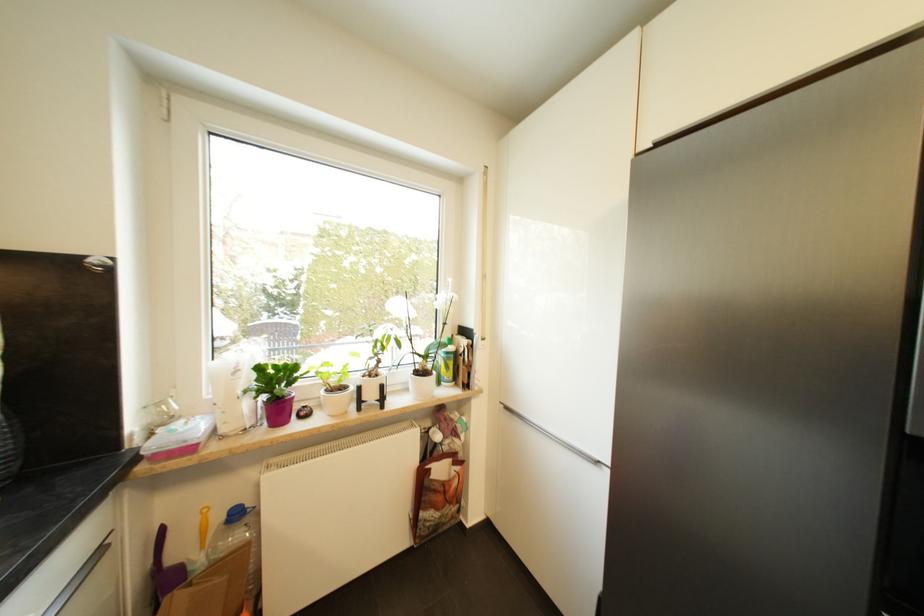
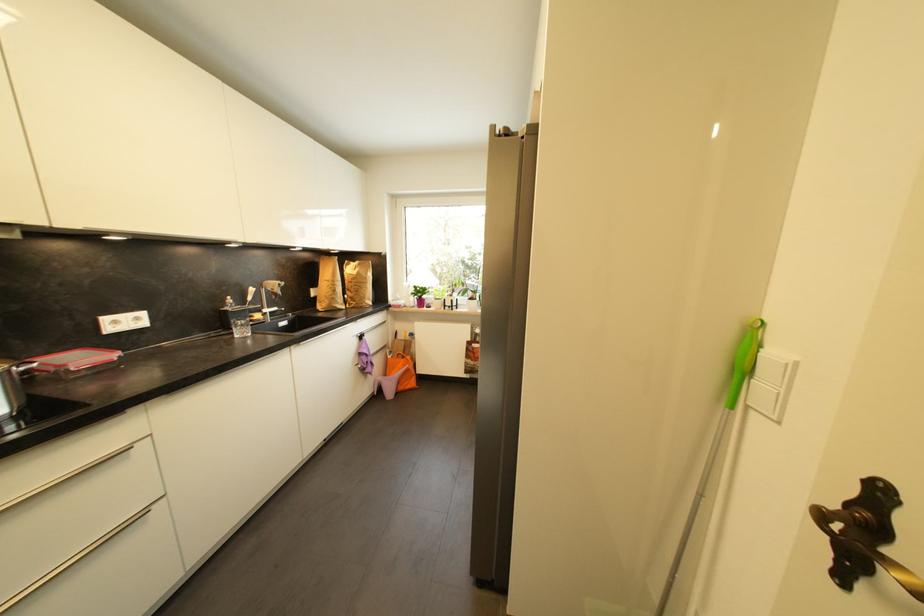
In the second image, find the point that corresponds to pixel 421 375 in the first image.

(475, 301)